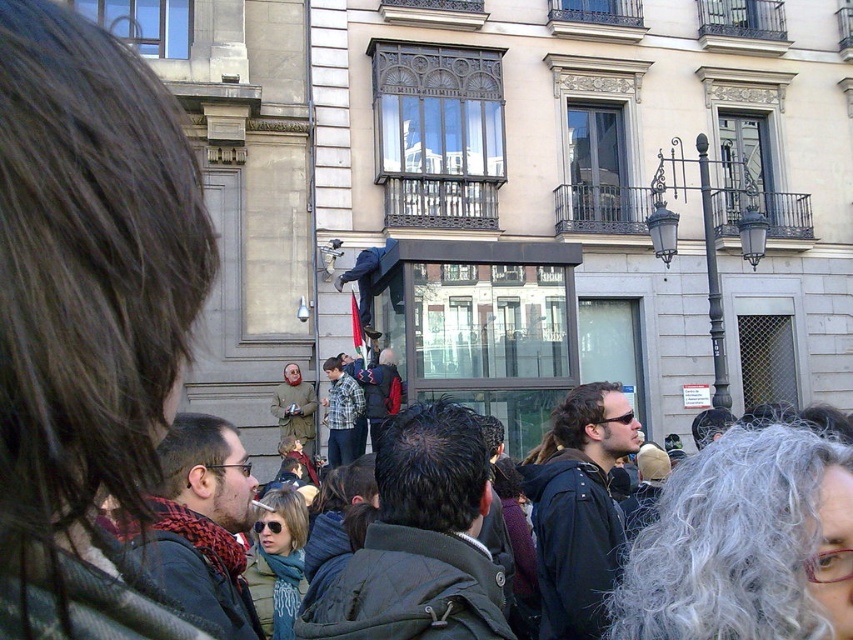
You are a photographer standing in the crowd and want to take a photo of both the red plaid scarf at lower left and the checkered fabric shirt at center. Which object should you focus on first to ensure both are in sharp focus?

You should focus on the red plaid scarf at lower left first because it is closer to the viewer than the checkered fabric shirt at center, ensuring both will be in focus when focusing on the closer object.

You are a photographer standing at the edge of the crowd. You want to take a photo of the checkered fabric shirt at center and the dark blue jacket at center without any obstruction. Given that your camera has a maximum focus range of 1.6 meters, will both subjects be in focus?

The distance between the checkered fabric shirt at center and the dark blue jacket at center is 1.50 meters, which is within the camera maximum focus range of 1.6 meters. Therefore, both subjects will be in focus.